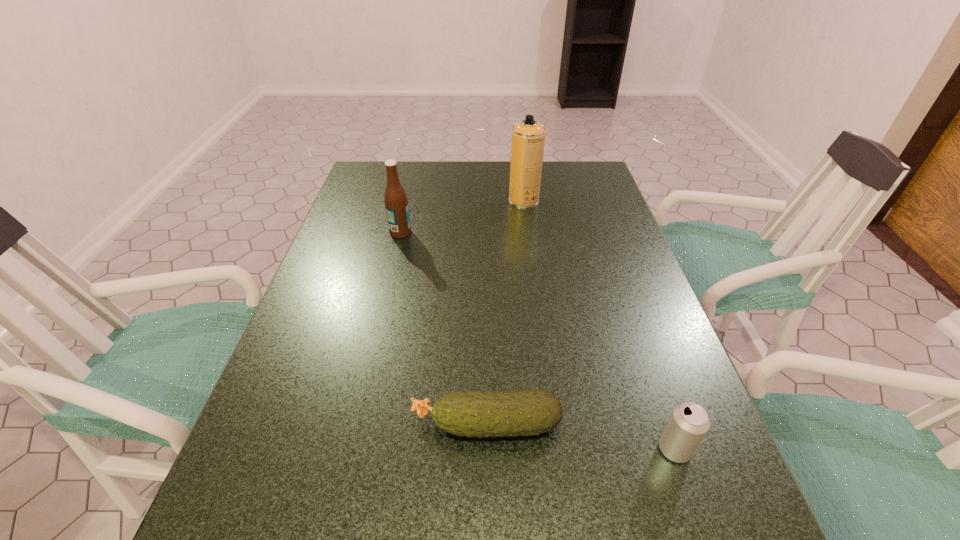
Image resolution: width=960 pixels, height=540 pixels. I want to click on vacant space that's between the leftmost object and the tallest object, so click(x=462, y=216).

I want to click on the second closest object relative to the farthest object, so click(x=523, y=412).

Locate an element on the screen. object that is the third closest to the rightmost object is located at coordinates (396, 204).

Find the location of a particular element. Image resolution: width=960 pixels, height=540 pixels. vacant area that satisfies the following two spatial constraints: 1. at the blossom end of the third tallest object; 2. on the left side of the shortest object is located at coordinates (487, 449).

Locate an element on the screen. The height and width of the screenshot is (540, 960). blank area in the image that satisfies the following two spatial constraints: 1. on the back side of the third tallest object; 2. at the blossom end of the shortest object is located at coordinates 666,424.

You are a GUI agent. You are given a task and a screenshot of the screen. Output one action in this format:
    pyautogui.click(x=<x>, y=<y>)
    Task: Click on the vacant area in the image that satisfies the following two spatial constraints: 1. at the blossom end of the shortest object; 2. on the right side of the second shortest object
    Image resolution: width=960 pixels, height=540 pixels.
    Given the screenshot: What is the action you would take?
    pyautogui.click(x=487, y=449)

At what (x,y) coordinates should I click in order to perform the action: click on vacant space that satisfies the following two spatial constraints: 1. on the front side of the aerosol can; 2. at the blossom end of the cucumber. Please return your answer as a coordinate pair (x, y). Looking at the image, I should click on (556, 424).

The width and height of the screenshot is (960, 540). I want to click on free location that satisfies the following two spatial constraints: 1. at the blossom end of the shortest object; 2. on the right side of the rightmost object, so click(487, 449).